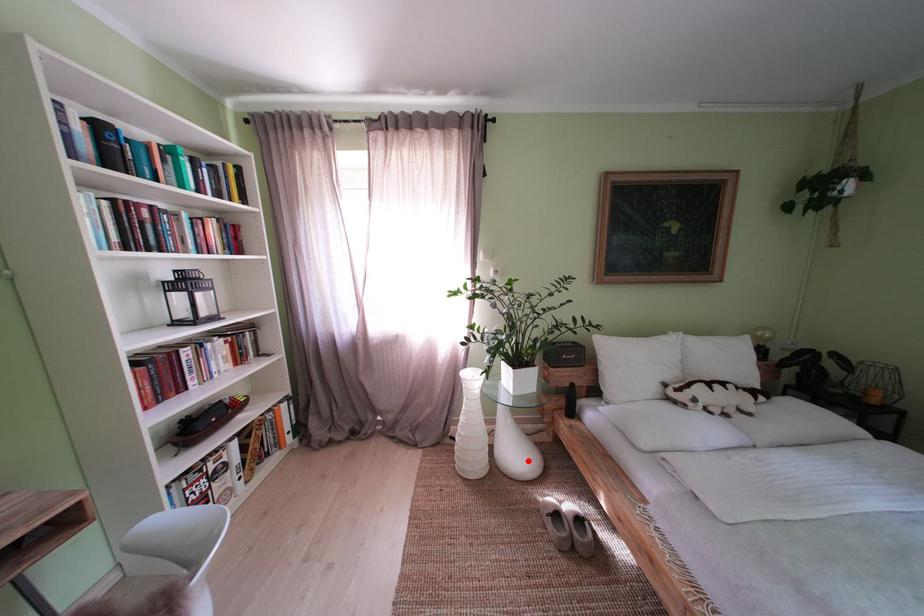
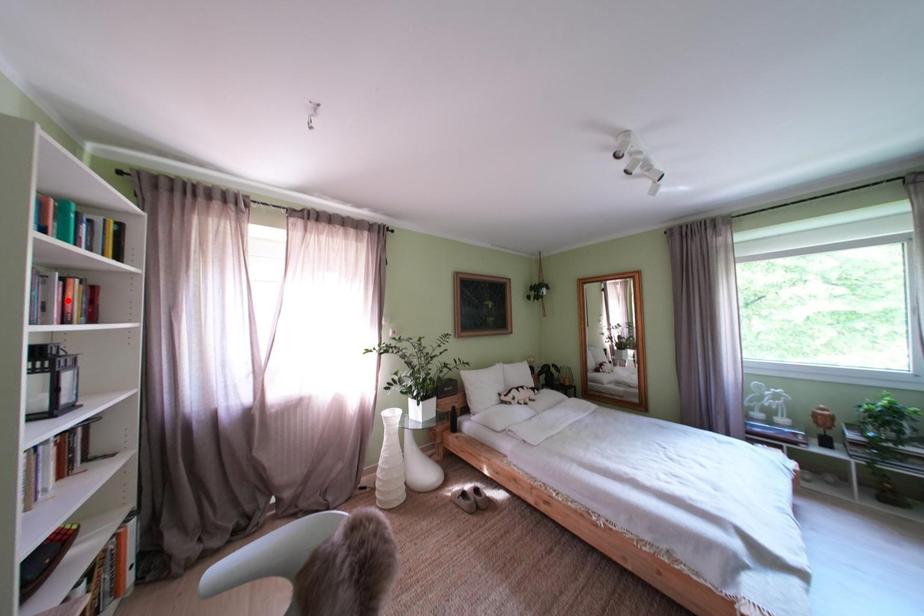
I am providing you with two images of the same scene from different viewpoints. A red point is marked on the first image and another point is marked on the second image. Is the marked point in image1 the same physical position as the marked point in image2?

No